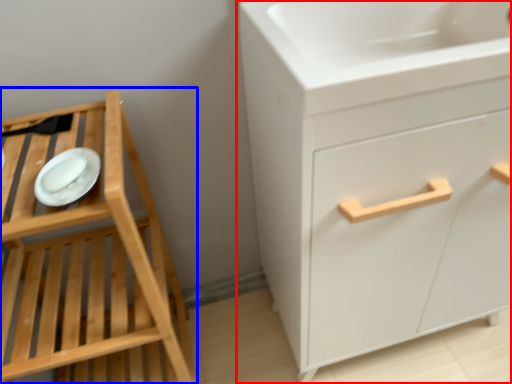
Question: Which object appears closest to the camera in this image, chest of drawers (highlighted by a red box) or furniture (highlighted by a blue box)?

Choices:
 (A) chest of drawers
 (B) furniture

Answer: (B)